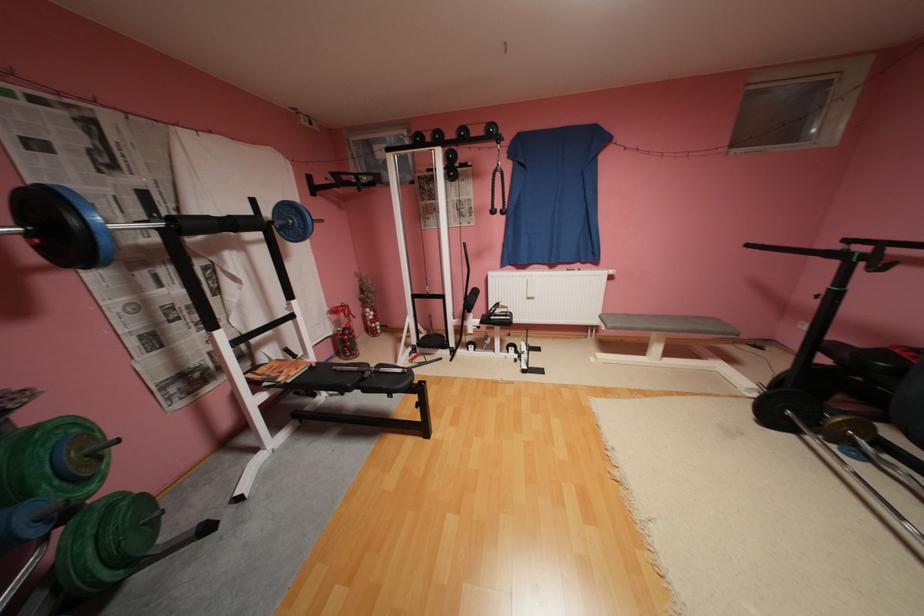
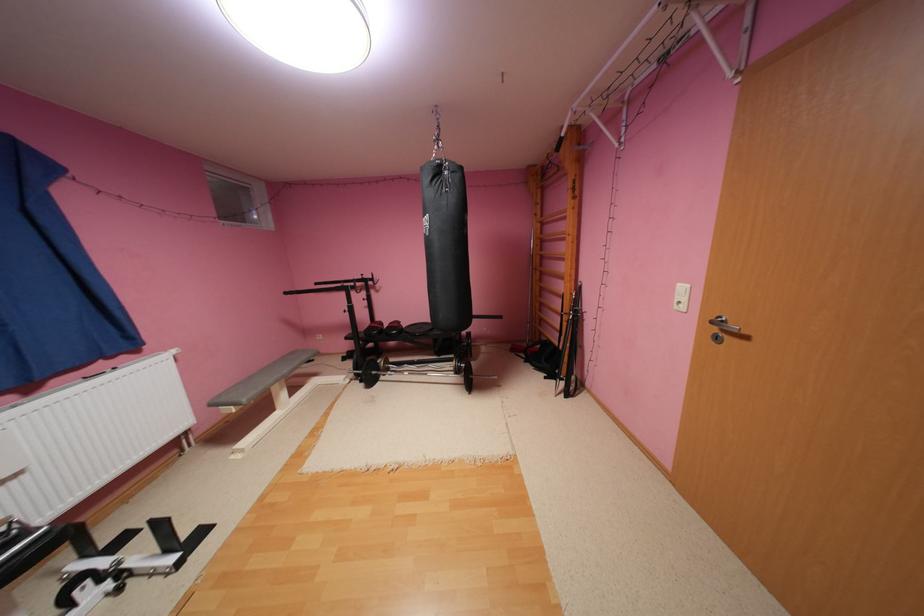
Locate, in the second image, the point that corresponds to the point at 537,299 in the first image.

(11, 483)